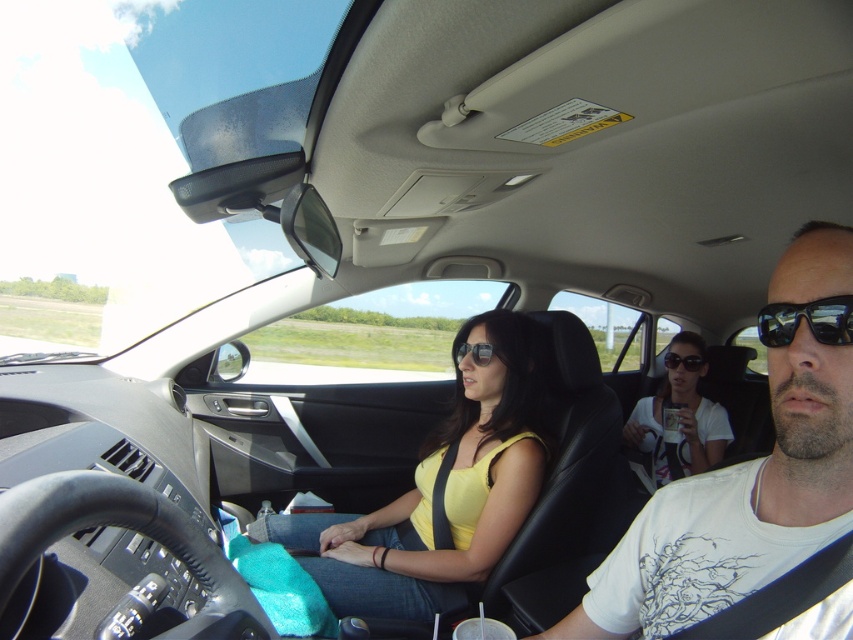
Question: Does white matte cup at center come in front of sunglasses at center?

Choices:
 (A) yes
 (B) no

Answer: (B)

Question: Estimate the real-world distances between objects in this image. Which object is farther from the matte black sunglasses at center?

Choices:
 (A) black plastic goggles at center
 (B) yellow fabric shirt at center
 (C) white cotton t-shirt at center

Answer: (A)

Question: Observing the image, what is the correct spatial positioning of yellow fabric shirt at center in reference to sunglasses at center?

Choices:
 (A) left
 (B) right

Answer: (A)

Question: Which of these objects is positioned farthest from the white matte cup at center?

Choices:
 (A) sunglasses at center
 (B) white cotton t-shirt at center
 (C) black plastic goggles at center

Answer: (A)

Question: Among these points, which one is farthest from the camera?

Choices:
 (A) (692, 353)
 (B) (805, 326)
 (C) (828, 320)

Answer: (A)

Question: Is white cotton t-shirt at center smaller than black plastic goggles at center?

Choices:
 (A) yes
 (B) no

Answer: (B)